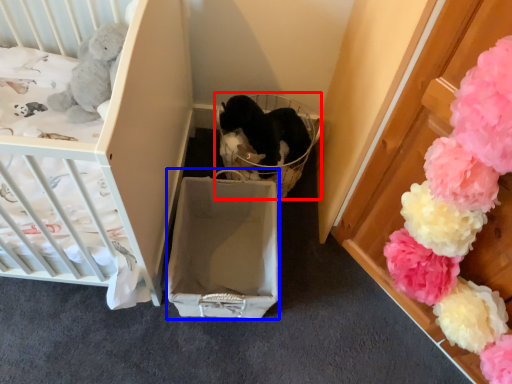
Question: Which point is further to the camera, baby carriage (highlighted by a red box) or cardboard box (highlighted by a blue box)?

Choices:
 (A) baby carriage
 (B) cardboard box

Answer: (A)